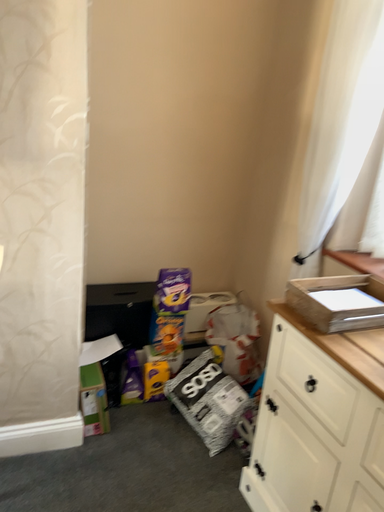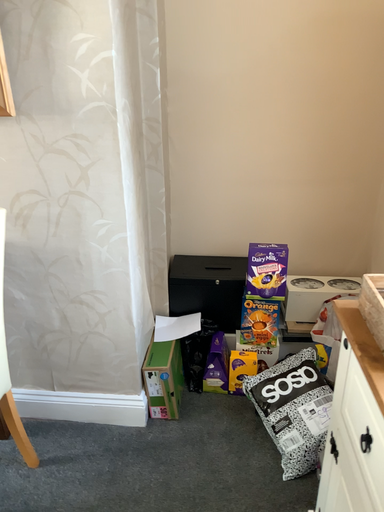
Question: How did the camera likely rotate when shooting the video?

Choices:
 (A) rotated right
 (B) rotated left

Answer: (B)